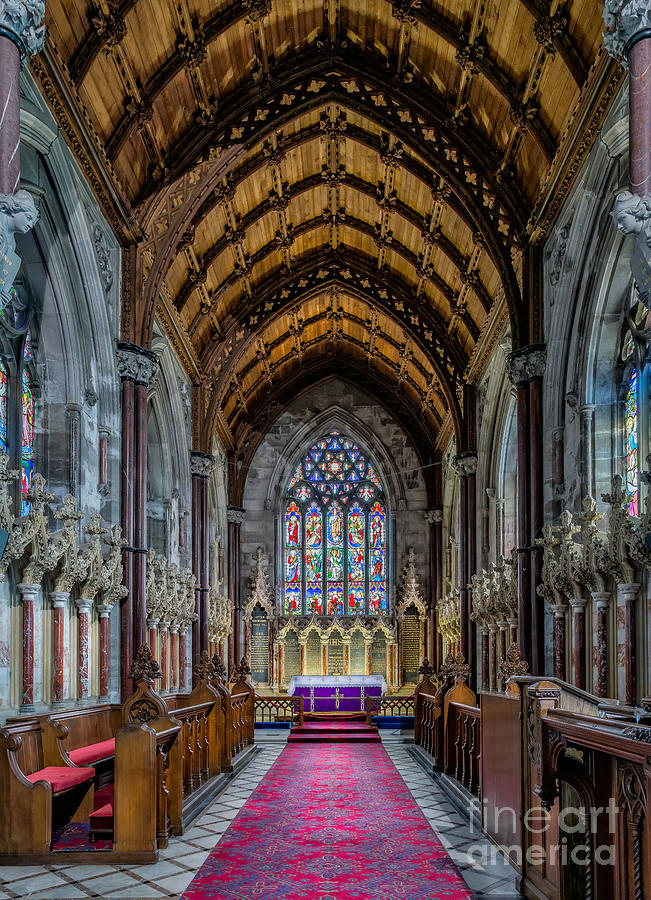
This screenshot has height=900, width=651. Identify the location of cross ornaments on top of pews. (142, 655), (204, 657), (217, 662), (242, 662), (428, 669), (445, 669), (456, 670), (514, 653).